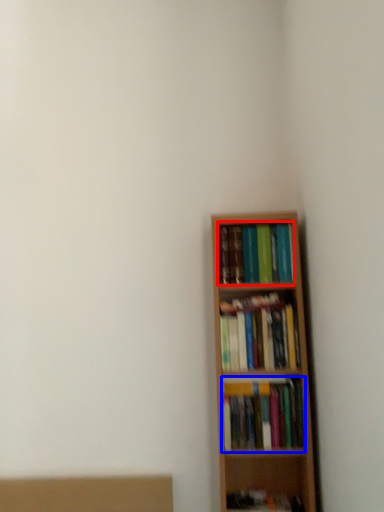
Question: Which object is further to the camera taking this photo, book (highlighted by a red box) or book (highlighted by a blue box)?

Choices:
 (A) book
 (B) book

Answer: (A)